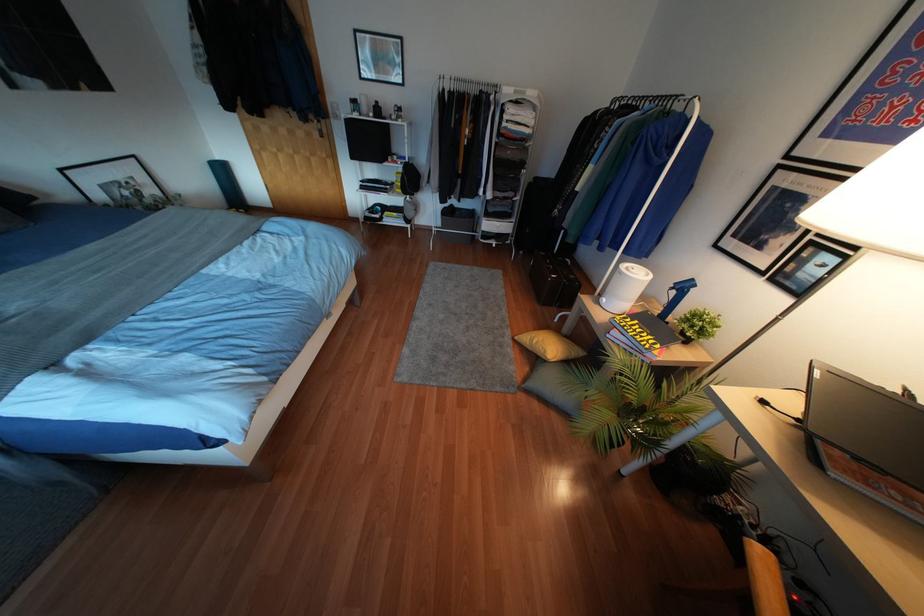
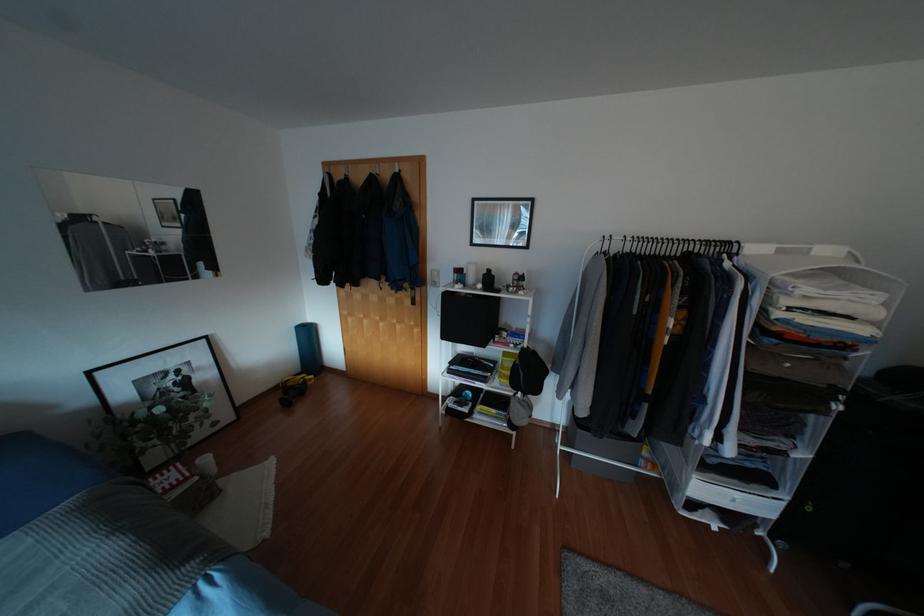
The point at (487, 84) is marked in the first image. Where is the corresponding point in the second image?

(707, 241)